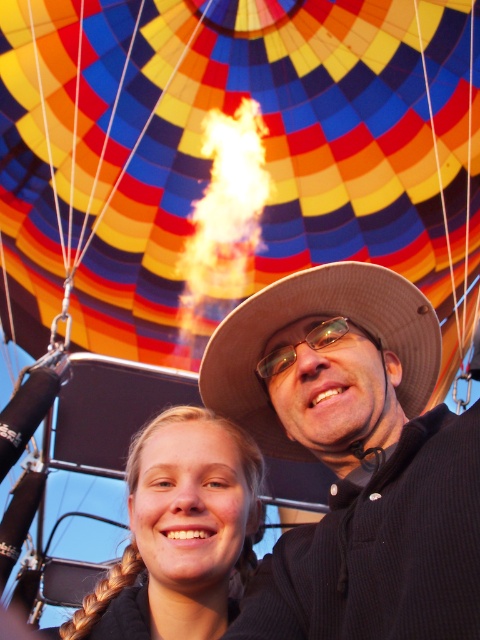
Is point (251, 476) more distant than point (266, 452)?

No, it is not.

Does blonde hair at center appear under brown woven hat at center?

Yes.

Where is `blonde hair at center`? blonde hair at center is located at coordinates (180, 532).

Does point (171, 346) come closer to viewer compared to point (288, 348)?

No, it is not.

Locate an element on the screen. multicolored fabric balloon at upper center is located at coordinates (208, 161).

Who is more forward, (x=310, y=33) or (x=317, y=324)?

Point (x=317, y=324) is in front.

Find the location of `multicolored fabric balloon at upper center`. multicolored fabric balloon at upper center is located at coordinates (208, 161).

Can you confirm if multicolored fabric balloon at upper center is positioned below brown woven hat at center?

Actually, multicolored fabric balloon at upper center is above brown woven hat at center.

Can you confirm if multicolored fabric balloon at upper center is smaller than brown woven hat at center?

No, multicolored fabric balloon at upper center is not smaller than brown woven hat at center.

The image size is (480, 640). Describe the element at coordinates (208, 161) in the screenshot. I see `multicolored fabric balloon at upper center` at that location.

The height and width of the screenshot is (640, 480). I want to click on multicolored fabric balloon at upper center, so click(x=208, y=161).